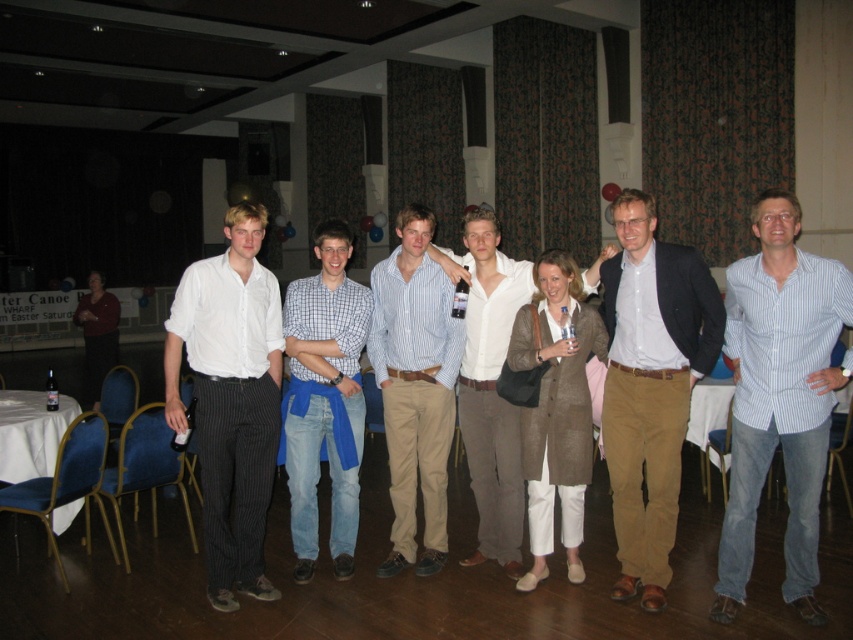
You are a photographer adjusting the lighting for a group photo. You notice two shirts in the center of the group, a blue striped shirt at center and a white cotton shirt at center. Which shirt should you adjust the lighting on to ensure it doesn not get lost in the background?

The blue striped shirt at center is shorter than the white cotton shirt at center, so you should adjust the lighting on the blue striped shirt at center to ensure it doesn not get lost in the background.

Looking at this image, you are a photographer taking a picture of the group. You notice the blue striped shirt at center and the white cotton shirt at center. Which one is closer to the camera?

The blue striped shirt at center is in front of the white cotton shirt at center, so it is closer to the camera.